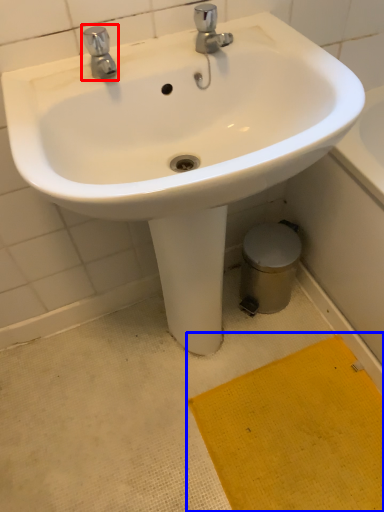
Question: Which object is closer to the camera taking this photo, tap (highlighted by a red box) or doormat (highlighted by a blue box)?

Choices:
 (A) tap
 (B) doormat

Answer: (A)